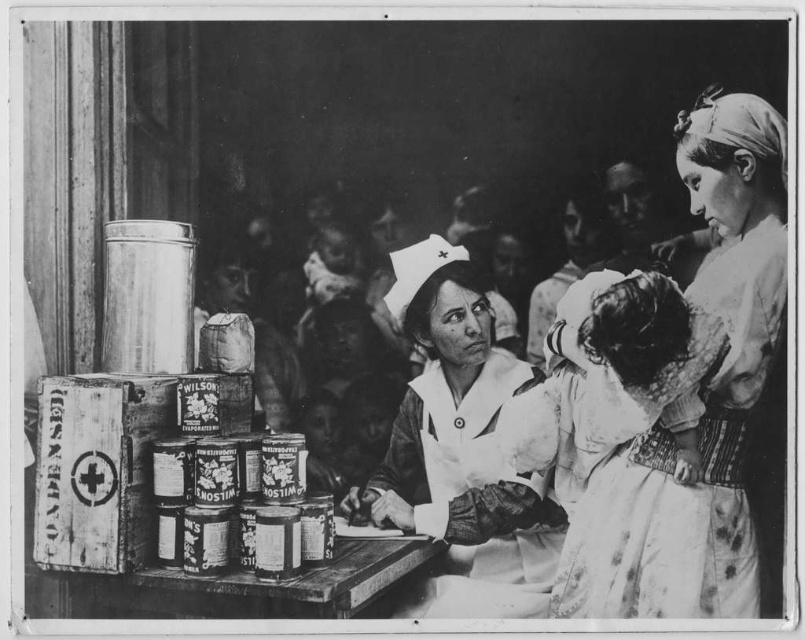
You are a photographer analyzing this historical image. You notice two white cotton garments in the scene. The first is the white cotton dress at upper right, and the second is the white cotton nurse uniform at center. Based on their positions, which garment is located higher up in the image?

The white cotton dress at upper right is located higher up in the image than the white cotton nurse uniform at center.

Based on the photo, you are a photographer trying to capture a closeup shot of the white cotton nurse uniform at center. You have a camera with a maximum focus range of 50 centimeters. Can you take the photo from where you are standing next to the white cotton dress at upper right without moving either object?

The distance between the white cotton dress at upper right and the white cotton nurse uniform at center is 58.02 centimeters, which exceeds the camera maximum focus range of 50 centimeters. Therefore, you cannot take the photo without moving either object.

You are a photographer analyzing this historical image. You notice two white cotton garments in the scene. The first is the white cotton dress at upper right, and the second is the white cotton nurse uniform at center. From your vantage point, which garment appears closer to you?

→ The white cotton dress at upper right is in front of the white cotton nurse uniform at center, so it appears closer.